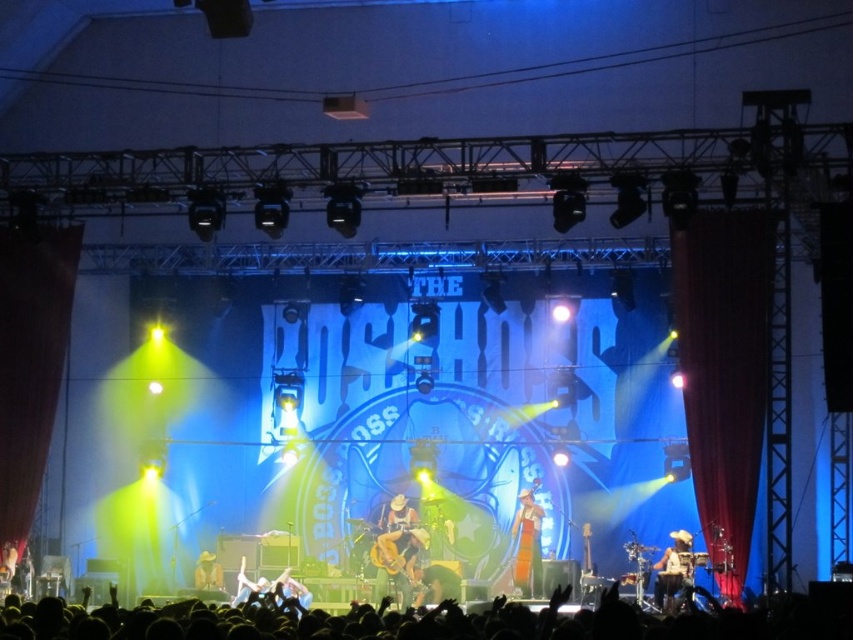
Question: Observing the image, what is the correct spatial positioning of shiny metallic cowboy hat at center in reference to yellow fabric hat at center?

Choices:
 (A) left
 (B) right

Answer: (B)

Question: Which point is closer to the camera?

Choices:
 (A) (772, 634)
 (B) (218, 572)
 (C) (392, 522)

Answer: (A)

Question: Does wooden acoustic guitar at center have a larger size compared to shiny metallic cowboy hat at center?

Choices:
 (A) yes
 (B) no

Answer: (B)

Question: Does shiny metallic cowboy hat at center have a greater width compared to white leather cowboy hat at center?

Choices:
 (A) no
 (B) yes

Answer: (B)

Question: Which object appears closest to the camera in this image?

Choices:
 (A) yellow fabric hat at center
 (B) shiny metallic cowboy hat at center
 (C) wooden acoustic guitar at center

Answer: (B)

Question: Which object appears farthest from the camera in this image?

Choices:
 (A) yellow fabric hat at center
 (B) wooden acoustic guitar at center
 (C) white leather cowboy hat at center
 (D) silhouette crowd at lower center

Answer: (B)